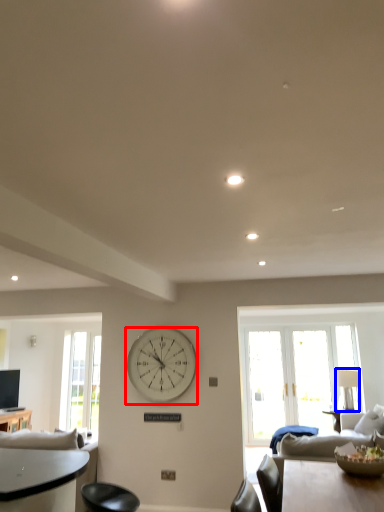
Question: Which of the following is the closest to the observer, wall clock (highlighted by a red box) or lamp (highlighted by a blue box)?

Choices:
 (A) wall clock
 (B) lamp

Answer: (A)